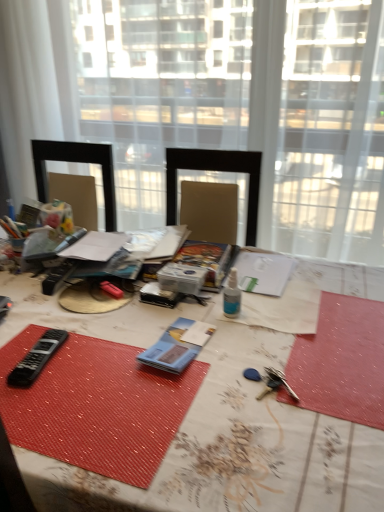
Measure the distance between black plastic remote at lower left, the second equipment positioned from the right, and camera.

They are 32.07 inches apart.

Describe the element at coordinates (209, 425) in the screenshot. I see `white textured table at center` at that location.

The image size is (384, 512). I want to click on transparent glass window at center, acting as the 2th window starting from the left, so click(331, 132).

At what (x,y) coordinates should I click in order to perform the action: click on black plastic remote at lower left, the second equipment positioned from the right. Please return your answer as a coordinate pair (x, y). The image size is (384, 512). Looking at the image, I should click on [x=37, y=358].

Between white textured table at center and black plastic remote at lower left, the second equipment positioned from the right, which one has smaller width?

With smaller width is black plastic remote at lower left, the second equipment positioned from the right.

Measure the distance between white textured table at center and black plastic remote at lower left, the second equipment positioned from the right.

They are 11.42 inches apart.

From the picture: Which is in front, white textured table at center or black plastic remote at lower left, the second equipment positioned from the right?

white textured table at center is in front.

Would you say white textured table at center is outside black plastic remote at lower left, the second equipment positioned from the right?

Yes, white textured table at center is located beyond the bounds of black plastic remote at lower left, the second equipment positioned from the right.

Is black plastic remote at lower left, the first equipment from the left, situated inside transparent glass window at center, acting as the 2th window starting from the left, or outside?

black plastic remote at lower left, the first equipment from the left, cannot be found inside transparent glass window at center, acting as the 2th window starting from the left.

What are the coordinates of `the 1st window positioned above the black plastic remote at lower left, the first equipment from the left (from the image's perspective)` in the screenshot? It's located at 331,132.

Can you confirm if black plastic remote at lower left, the first equipment from the left, is positioned to the left of transparent glass window at center, which is the 1th window from right to left?

Correct, you'll find black plastic remote at lower left, the first equipment from the left, to the left of transparent glass window at center, which is the 1th window from right to left.

Does point (328, 135) lie behind point (47, 342)?

Yes, point (328, 135) is behind point (47, 342).

Considering the relative sizes of transparent glass window at center, the second window viewed from the right, and black plastic remote at lower left, the first equipment from the left, in the image provided, is transparent glass window at center, the second window viewed from the right, thinner than black plastic remote at lower left, the first equipment from the left,?

Yes.

Would you say transparent glass window at center, the second window viewed from the right, is to the left or to the right of black plastic remote at lower left, the first equipment from the left, in the picture?

transparent glass window at center, the second window viewed from the right, is positioned on black plastic remote at lower left, the first equipment from the left,'s right side.

From a real-world perspective, is transparent glass window at center, the first window when ordered from left to right, above or below black plastic remote at lower left, the second equipment positioned from the right?

transparent glass window at center, the first window when ordered from left to right, is above black plastic remote at lower left, the second equipment positioned from the right.

Is blue paper at center, which is the second equipment in left-to-right order, positioned beyond the bounds of transparent glass window at center, the second window viewed from the right?

Yes, blue paper at center, which is the second equipment in left-to-right order, is not within transparent glass window at center, the second window viewed from the right.

Is blue paper at center, which is the second equipment in left-to-right order, far away from transparent glass window at center, the first window when ordered from left to right?

Yes, blue paper at center, which is the second equipment in left-to-right order, and transparent glass window at center, the first window when ordered from left to right, are quite far apart.

Considering the relative positions of blue paper at center, the first equipment when ordered from right to left, and transparent glass window at center, the first window when ordered from left to right, in the image provided, is blue paper at center, the first equipment when ordered from right to left, to the left of transparent glass window at center, the first window when ordered from left to right, from the viewer's perspective?

Incorrect, blue paper at center, the first equipment when ordered from right to left, is not on the left side of transparent glass window at center, the first window when ordered from left to right.

From a real-world perspective, is transparent glass window at center, the second window viewed from the right, above or below blue paper at center, which is the second equipment in left-to-right order?

From a real-world perspective, transparent glass window at center, the second window viewed from the right, is physically above blue paper at center, which is the second equipment in left-to-right order.

Would you say blue paper at center, the first equipment when ordered from right to left, is part of transparent glass window at center, the first window when ordered from left to right,'s contents?

No, transparent glass window at center, the first window when ordered from left to right, does not contain blue paper at center, the first equipment when ordered from right to left.

Is transparent glass window at center, the second window viewed from the right, positioned far away from blue paper at center, the first equipment when ordered from right to left?

transparent glass window at center, the second window viewed from the right, is far away from blue paper at center, the first equipment when ordered from right to left.

Based on their sizes in the image, would you say transparent glass window at center, the first window when ordered from left to right, is bigger or smaller than blue paper at center, the first equipment when ordered from right to left?

In the image, transparent glass window at center, the first window when ordered from left to right, appears to be larger than blue paper at center, the first equipment when ordered from right to left.

Consider the image. Which object is further away from the camera, blue paper at center, which is the second equipment in left-to-right order, or white textured table at center?

Positioned behind is blue paper at center, which is the second equipment in left-to-right order.

What are the coordinates of `table in front of the blue paper at center, which is the second equipment in left-to-right order` in the screenshot? It's located at (209, 425).

Considering the sizes of blue paper at center, which is the second equipment in left-to-right order, and white textured table at center in the image, is blue paper at center, which is the second equipment in left-to-right order, wider or thinner than white textured table at center?

In the image, blue paper at center, which is the second equipment in left-to-right order, appears to be more narrow than white textured table at center.

Is blue paper at center, the first equipment when ordered from right to left, positioned beyond the bounds of white textured table at center?

Actually, blue paper at center, the first equipment when ordered from right to left, is at least partially inside white textured table at center.

Is transparent glass window at center, acting as the 2th window starting from the left, further to the viewer compared to white textured table at center?

Yes, transparent glass window at center, acting as the 2th window starting from the left, is further from the viewer.

Who is bigger, transparent glass window at center, acting as the 2th window starting from the left, or white textured table at center?

white textured table at center is bigger.

Could you tell me if transparent glass window at center, which is the 1th window from right to left, is facing white textured table at center?

Yes, transparent glass window at center, which is the 1th window from right to left, is turned towards white textured table at center.

Locate an element on the screen. table that is under the black plastic remote at lower left, the second equipment positioned from the right (from a real-world perspective) is located at coordinates (209, 425).

From the image's perspective, starting from the transparent glass window at center, which is the 1th window from right to left, which equipment is the 2nd one below? Please provide its 2D coordinates.

[(37, 358)]

Considering their positions, is white textured table at center positioned further to transparent glass window at center, the second window viewed from the right, than transparent glass window at center, which is the 1th window from right to left?

white textured table at center lies further to transparent glass window at center, the second window viewed from the right, than the other object.

Based on their spatial positions, is transparent glass window at center, acting as the 2th window starting from the left, or white textured table at center further from transparent glass window at center, the second window viewed from the right?

white textured table at center lies further to transparent glass window at center, the second window viewed from the right, than the other object.

From the picture: Estimate the real-world distances between objects in this image. Which object is closer to blue paper at center, the first equipment when ordered from right to left, white textured table at center or transparent glass window at center, acting as the 2th window starting from the left?

The object closer to blue paper at center, the first equipment when ordered from right to left, is white textured table at center.

From the image, which object appears to be nearer to transparent glass window at center, acting as the 2th window starting from the left, black plastic remote at lower left, the first equipment from the left, or transparent glass window at center, the first window when ordered from left to right?

The object closer to transparent glass window at center, acting as the 2th window starting from the left, is transparent glass window at center, the first window when ordered from left to right.

Looking at the image, which one is located closer to white textured table at center, transparent glass window at center, the second window viewed from the right, or blue paper at center, which is the second equipment in left-to-right order?

blue paper at center, which is the second equipment in left-to-right order, lies closer to white textured table at center than the other object.

Based on their spatial positions, is transparent glass window at center, the first window when ordered from left to right, or black plastic remote at lower left, the first equipment from the left, closer to transparent glass window at center, acting as the 2th window starting from the left?

The object closer to transparent glass window at center, acting as the 2th window starting from the left, is transparent glass window at center, the first window when ordered from left to right.

Considering their positions, is black plastic remote at lower left, the first equipment from the left, positioned further to blue paper at center, the first equipment when ordered from right to left, than transparent glass window at center, which is the 1th window from right to left?

Based on the image, transparent glass window at center, which is the 1th window from right to left, appears to be further to blue paper at center, the first equipment when ordered from right to left.

From the image, which object appears to be nearer to white textured table at center, transparent glass window at center, which is the 1th window from right to left, or blue paper at center, the first equipment when ordered from right to left?

blue paper at center, the first equipment when ordered from right to left, lies closer to white textured table at center than the other object.

At what (x,y) coordinates should I click in order to perform the action: click on equipment located between black plastic remote at lower left, the first equipment from the left, and transparent glass window at center, acting as the 2th window starting from the left, in the left-right direction. Please return your answer as a coordinate pair (x, y). The image size is (384, 512). Looking at the image, I should click on (172, 349).

Where is `window situated between black plastic remote at lower left, the second equipment positioned from the right, and transparent glass window at center, which is the 1th window from right to left, from left to right`? window situated between black plastic remote at lower left, the second equipment positioned from the right, and transparent glass window at center, which is the 1th window from right to left, from left to right is located at coordinates (161, 86).

You are a GUI agent. You are given a task and a screenshot of the screen. Output one action in this format:
    pyautogui.click(x=<x>, y=<y>)
    Task: Click on the window between transparent glass window at center, the second window viewed from the right, and white textured table at center, in the vertical direction
    The image size is (384, 512).
    Given the screenshot: What is the action you would take?
    pyautogui.click(x=331, y=132)

At what (x,y) coordinates should I click in order to perform the action: click on table between black plastic remote at lower left, the second equipment positioned from the right, and transparent glass window at center, which is the 1th window from right to left. Please return your answer as a coordinate pair (x, y). Looking at the image, I should click on (209, 425).